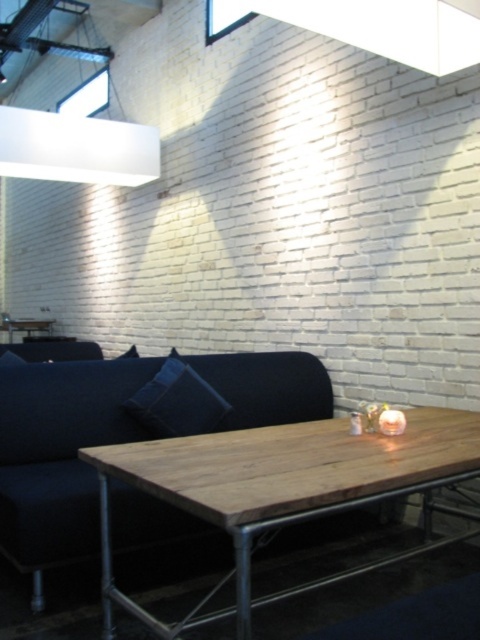
Question: Which of the following is the farthest from the observer?

Choices:
 (A) (148, 422)
 (B) (26, 538)
 (C) (68, 150)

Answer: (C)

Question: Considering the real-world distances, which object is closest to the dark blue fabric couch at center?

Choices:
 (A) white matte rectangular light fixture at upper left
 (B) dark blue fabric pillow at center

Answer: (B)

Question: From the image, what is the correct spatial relationship of white matte rectangular light fixture at upper left in relation to dark blue fabric pillow at center?

Choices:
 (A) right
 (B) left

Answer: (B)

Question: Is rustic wood table at center above dark blue fabric pillow at center?

Choices:
 (A) no
 (B) yes

Answer: (A)

Question: Which point appears farthest from the camera in this image?

Choices:
 (A) (127, 492)
 (B) (191, 433)

Answer: (B)

Question: Does rustic wood table at center come behind dark blue fabric pillow at center?

Choices:
 (A) no
 (B) yes

Answer: (A)